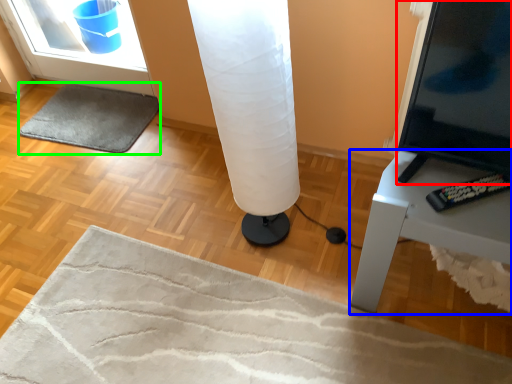
Question: Which object is the closest to the screen (highlighted by a red box)? Choose among these: furniture (highlighted by a blue box) or yoga mat (highlighted by a green box).

Choices:
 (A) furniture
 (B) yoga mat

Answer: (A)